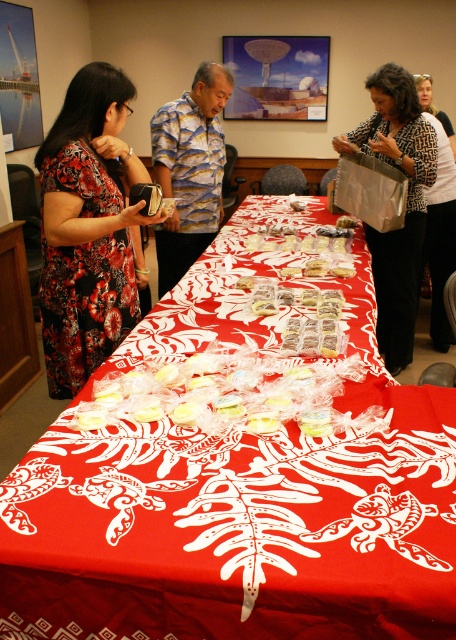
Who is taller, leopard print jacket at upper center or white glossy cake at center?

leopard print jacket at upper center

Between leopard print jacket at upper center and white glossy cake at center, which one has less height?

Standing shorter between the two is white glossy cake at center.

Measure the distance between leopard print jacket at upper center and camera.

leopard print jacket at upper center is 9.23 feet from camera.

This screenshot has width=456, height=640. I want to click on leopard print jacket at upper center, so click(440, 214).

Can you confirm if floral dress at left is positioned to the left of white glossy cookies at center?

Indeed, floral dress at left is positioned on the left side of white glossy cookies at center.

Describe the element at coordinates (86, 230) in the screenshot. I see `floral dress at left` at that location.

Between point (82, 148) and point (337, 266), which one is positioned in front?

Positioned in front is point (82, 148).

Find the location of `floral dress at left`. floral dress at left is located at coordinates (86, 230).

Which is in front, point (376, 292) or point (337, 268)?

Point (337, 268) is in front.

Does point (392, 77) come farther from viewer compared to point (355, 269)?

Yes, it is behind point (355, 269).

The height and width of the screenshot is (640, 456). What do you see at coordinates (405, 204) in the screenshot?
I see `matte silver bag at center` at bounding box center [405, 204].

I want to click on matte silver bag at center, so click(405, 204).